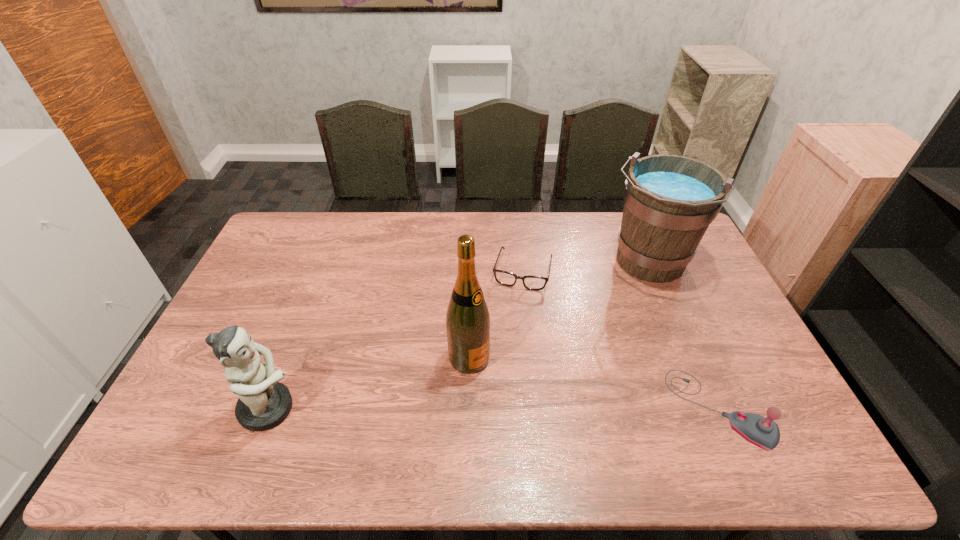
Where is `joystick that is at the near edge`? joystick that is at the near edge is located at coordinates (763, 432).

In order to click on joystick that is positioned at the right edge in this screenshot , I will do `click(763, 432)`.

Locate an element on the screen. Image resolution: width=960 pixels, height=540 pixels. wine bucket that is positioned at the right edge is located at coordinates (669, 200).

I want to click on object that is at the far right corner, so click(669, 200).

I want to click on object positioned at the near right corner, so click(763, 432).

Find the location of a particular element. The height and width of the screenshot is (540, 960). free space at the far edge is located at coordinates (565, 232).

The width and height of the screenshot is (960, 540). Identify the location of vacant space at the left edge of the desktop. (190, 381).

Where is `vacant space at the right edge of the desktop`? vacant space at the right edge of the desktop is located at coordinates (716, 356).

This screenshot has width=960, height=540. I want to click on free spot at the far left corner of the desktop, so pos(292,214).

Where is `free space between the wine bucket and the fourth object from right to left`? free space between the wine bucket and the fourth object from right to left is located at coordinates (558, 311).